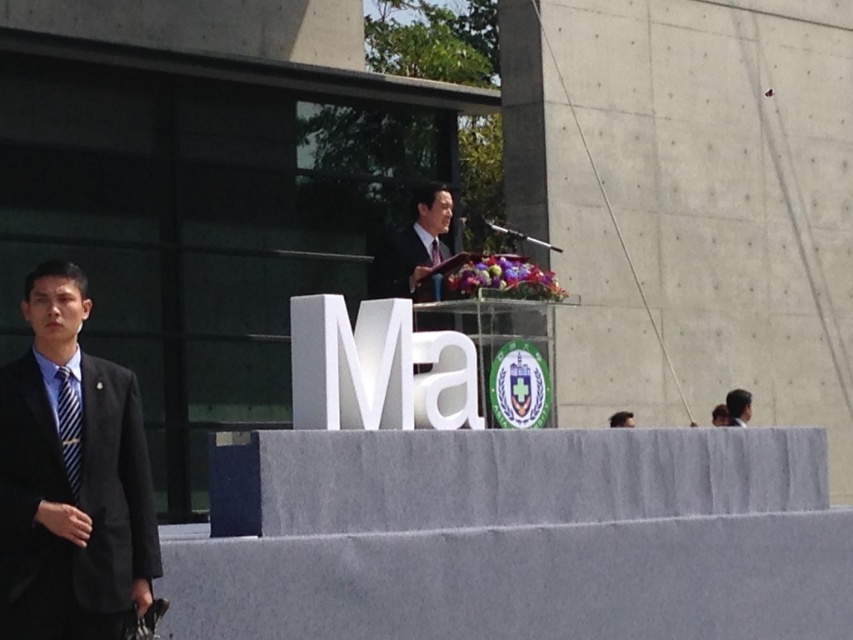
Who is lower down, matte black suit at center or blue striped tie at left?

blue striped tie at left is below.

Measure the distance between matte black suit at center and camera.

15.28 meters

Where is `matte black suit at center`? This screenshot has height=640, width=853. matte black suit at center is located at coordinates (412, 248).

Who is more distant from viewer, (109, 637) or (747, 392)?

The point (747, 392) is behind.

How far apart are black suit at left and dark brown hair at upper right?

black suit at left and dark brown hair at upper right are 12.90 meters apart from each other.

Which is behind, point (35, 372) or point (747, 412)?

The point (747, 412) is more distant.

Locate an element on the screen. black suit at left is located at coordinates (71, 477).

Between black suit at left and matte black suit at center, which one appears on the left side from the viewer's perspective?

Positioned to the left is black suit at left.

Is black suit at left behind matte black suit at center?

That is False.

The height and width of the screenshot is (640, 853). In order to click on black suit at left in this screenshot , I will do `click(71, 477)`.

Find the location of a particular element. The width and height of the screenshot is (853, 640). black suit at left is located at coordinates (71, 477).